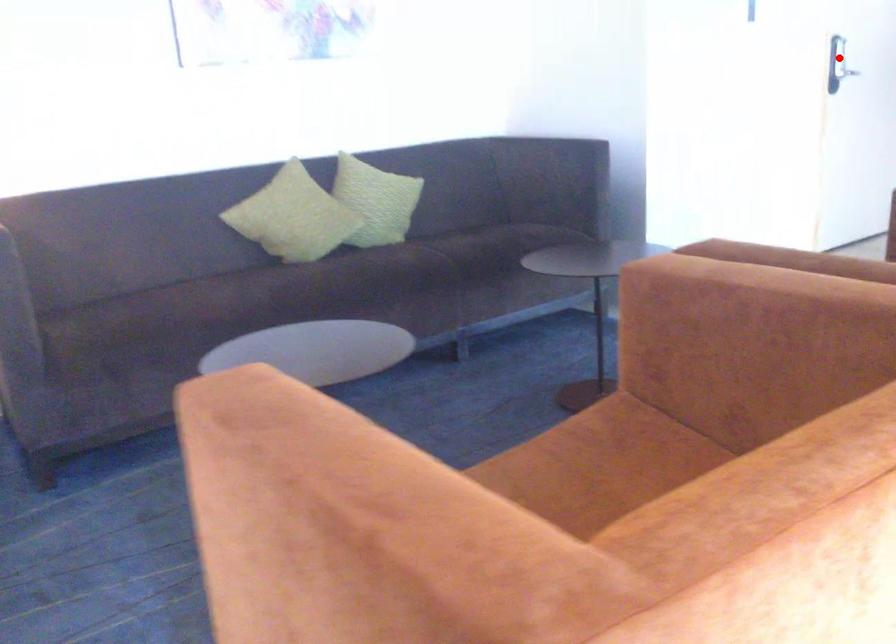
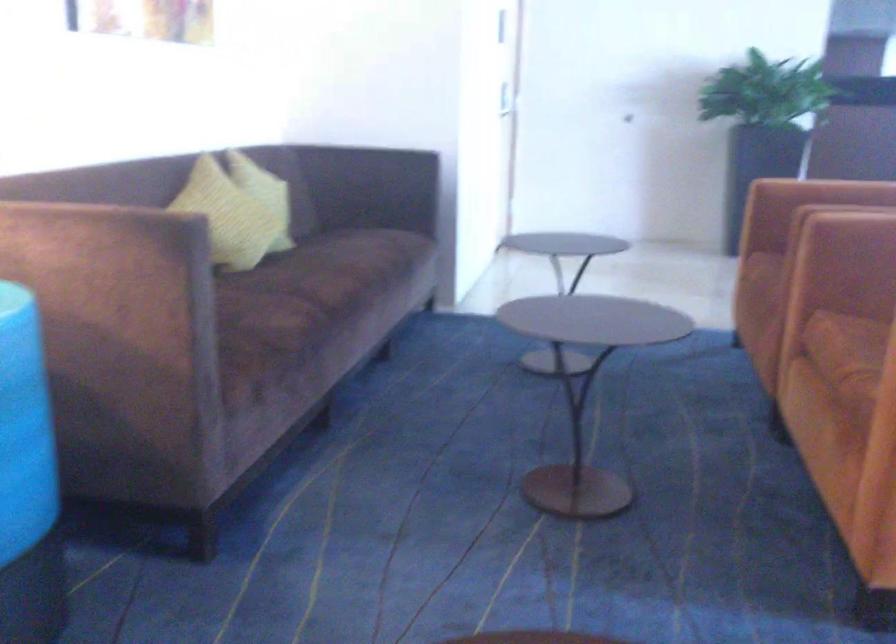
Question: I am providing you with two images of the same scene from different viewpoints. A red point is marked on the first image. Can you still see the location of the red point in image 2?

Choices:
 (A) Yes
 (B) No

Answer: (B)